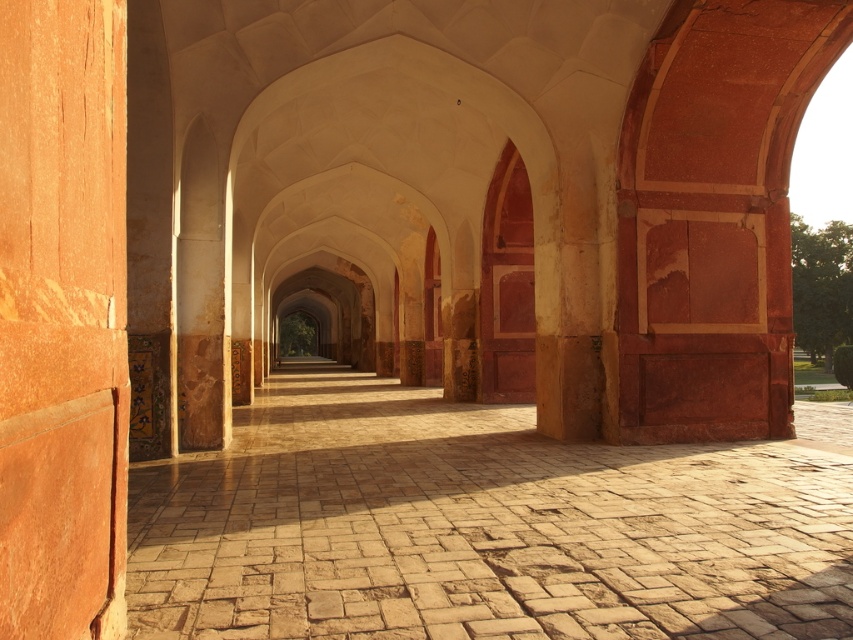
Question: Is brown stone path at center positioned in front of smooth orange stone pillar at left?

Choices:
 (A) yes
 (B) no

Answer: (B)

Question: Can you confirm if brown stone path at center is positioned to the left of smooth orange stone pillar at left?

Choices:
 (A) no
 (B) yes

Answer: (A)

Question: Which point is closer to the camera?

Choices:
 (A) (297, 364)
 (B) (4, 212)

Answer: (B)

Question: Which of the following is the farthest from the observer?

Choices:
 (A) (x=378, y=605)
 (B) (x=85, y=189)

Answer: (A)

Question: Is brown stone path at center positioned in front of smooth orange stone pillar at left?

Choices:
 (A) no
 (B) yes

Answer: (A)

Question: Which point is farther to the camera?

Choices:
 (A) (218, 532)
 (B) (109, 122)

Answer: (A)